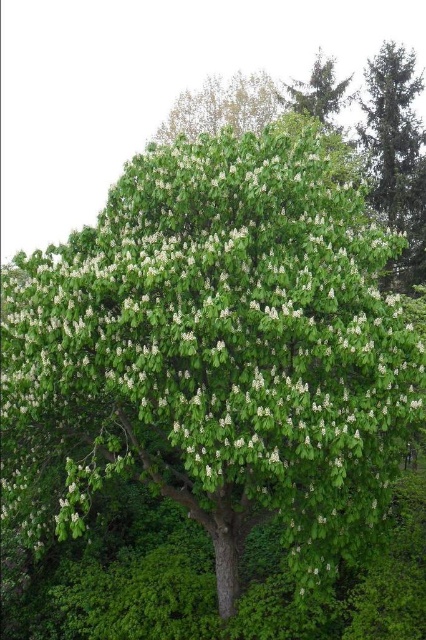
Question: Which object is farther from the camera taking this photo?

Choices:
 (A) green matte tree at upper right
 (B) green leafy tree at upper center

Answer: (B)

Question: From the image, what is the correct spatial relationship of green matte tree at upper right in relation to green leafy tree at upper center?

Choices:
 (A) below
 (B) above

Answer: (A)

Question: Can you confirm if green matte tree at upper right is bigger than green leafy tree at upper center?

Choices:
 (A) no
 (B) yes

Answer: (B)

Question: Among these objects, which one is nearest to the camera?

Choices:
 (A) green matte tree at upper right
 (B) green leafy tree at upper center

Answer: (A)

Question: Can you confirm if green matte tree at upper right is positioned above green leafy tree at upper center?

Choices:
 (A) yes
 (B) no

Answer: (B)